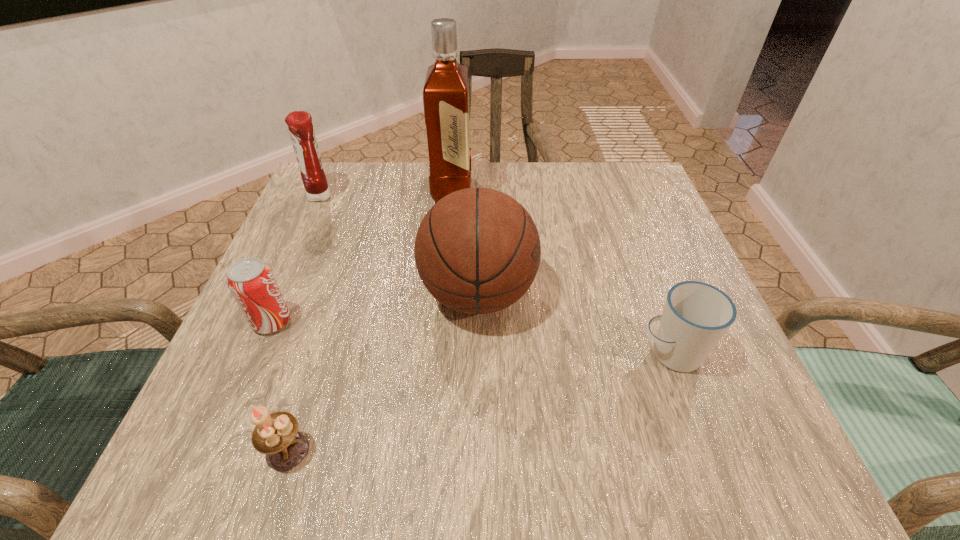
The width and height of the screenshot is (960, 540). What are the coordinates of `vacant region located on the logo side of the soda can` in the screenshot? It's located at (376, 322).

I want to click on free space located 0.360m with a handle on the side of the cup, so click(x=419, y=354).

Find the location of a particular element. The image size is (960, 540). free space located with a handle on the side of the cup is located at coordinates (455, 354).

The width and height of the screenshot is (960, 540). Identify the location of vacant region located 0.240m with a handle on the side of the cup. (492, 354).

What are the coordinates of `vacant space located 0.170m on the back of the nearest object` in the screenshot? It's located at (324, 336).

Locate an element on the screen. This screenshot has width=960, height=540. liquor located in the far edge section of the desktop is located at coordinates (446, 90).

Where is `condiment present at the far edge`? condiment present at the far edge is located at coordinates (301, 130).

The height and width of the screenshot is (540, 960). What are the coordinates of `object located at the near edge` in the screenshot? It's located at (276, 435).

At what (x,y) coordinates should I click in order to perform the action: click on condiment that is at the left edge. Please return your answer as a coordinate pair (x, y). Looking at the image, I should click on (301, 130).

Locate an element on the screen. The image size is (960, 540). soda can positioned at the left edge is located at coordinates (252, 283).